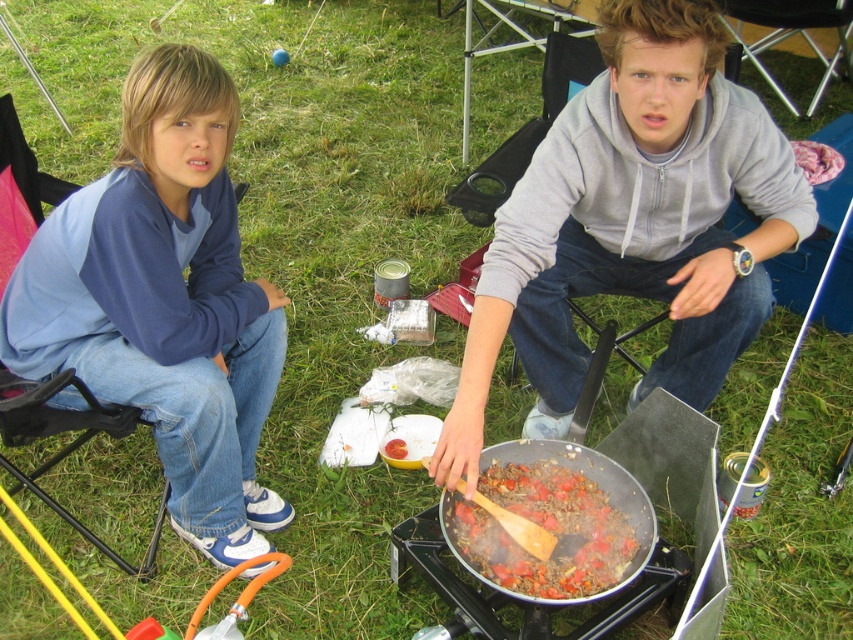
Question: Is blue cotton sweatshirt at left below brown matte wooden spoon at center?

Choices:
 (A) yes
 (B) no

Answer: (B)

Question: Considering the real-world distances, which object is farthest from the gray hoodie at center?

Choices:
 (A) brown matte wooden spoon at center
 (B) blue cotton sweatshirt at left

Answer: (B)

Question: Among these objects, which one is farthest from the camera?

Choices:
 (A) brown matte wooden spoon at center
 (B) blue cotton sweatshirt at left
 (C) gray hoodie at center

Answer: (A)

Question: Does gray hoodie at center appear on the left side of brown matte wooden spoon at center?

Choices:
 (A) no
 (B) yes

Answer: (A)

Question: Is blue cotton sweatshirt at left below brown matte wooden spoon at center?

Choices:
 (A) no
 (B) yes

Answer: (A)

Question: Which of the following is the farthest from the observer?

Choices:
 (A) (660, 246)
 (B) (230, 394)
 (C) (598, 500)

Answer: (A)